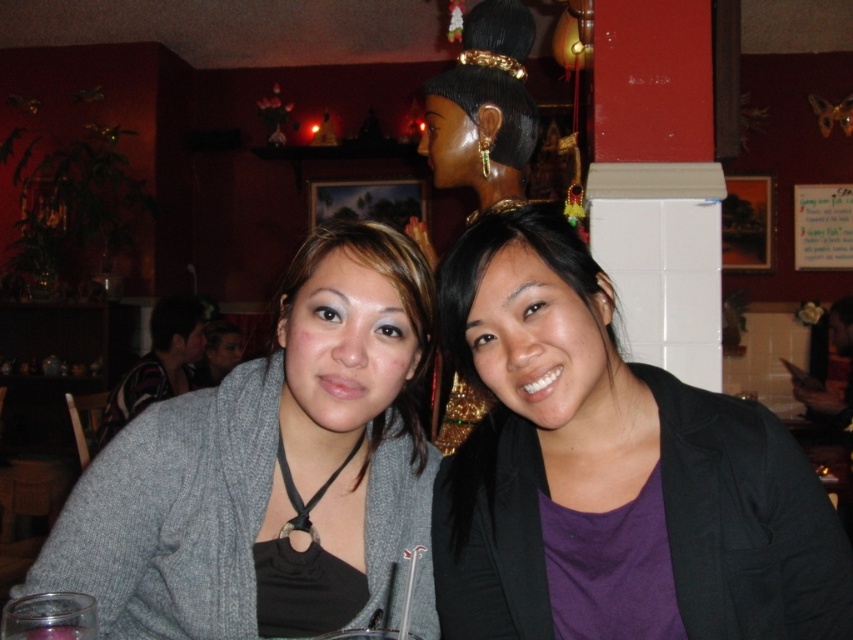
What is the color and material of the clothing item located at the coordinates point (611, 472)?

The clothing item at point (611, 472) is a purple matte and black blazer.

You are standing in the restaurant and want to place a small decorative item on the table between the two points labeled point (x=815, y=628) and point (x=213, y=634). Which point should you choose if you want the item to be closer to you?

Point (x=815, y=628) is closer to the viewer than point (x=213, y=634), so you should place the item on point (x=815, y=628) to have it closer to you.